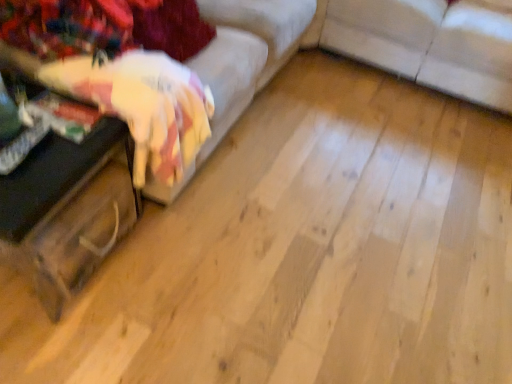
Question: Does velvet fabric couch at left, positioned as the first studio couch in left-to-right order, lie behind wooden trunk at left?

Choices:
 (A) no
 (B) yes

Answer: (A)

Question: Considering the relative positions of velvet fabric couch at left, which is counted as the second studio couch, starting from the right, and wooden trunk at left in the image provided, is velvet fabric couch at left, which is counted as the second studio couch, starting from the right, to the left of wooden trunk at left from the viewer's perspective?

Choices:
 (A) no
 (B) yes

Answer: (A)

Question: Considering the relative positions of velvet fabric couch at left, which is counted as the second studio couch, starting from the right, and wooden trunk at left in the image provided, is velvet fabric couch at left, which is counted as the second studio couch, starting from the right, to the right of wooden trunk at left from the viewer's perspective?

Choices:
 (A) yes
 (B) no

Answer: (A)

Question: Is velvet fabric couch at left, positioned as the first studio couch in left-to-right order, in contact with wooden trunk at left?

Choices:
 (A) yes
 (B) no

Answer: (B)

Question: Does velvet fabric couch at left, positioned as the first studio couch in left-to-right order, lie in front of wooden trunk at left?

Choices:
 (A) yes
 (B) no

Answer: (A)

Question: Visually, is velvet fabric couch at left, which is counted as the second studio couch, starting from the right, positioned to the left or to the right of wooden trunk at left?

Choices:
 (A) right
 (B) left

Answer: (A)

Question: From their relative heights in the image, would you say velvet fabric couch at left, positioned as the first studio couch in left-to-right order, is taller or shorter than wooden trunk at left?

Choices:
 (A) tall
 (B) short

Answer: (A)

Question: Would you say velvet fabric couch at left, positioned as the first studio couch in left-to-right order, is inside or outside wooden trunk at left?

Choices:
 (A) outside
 (B) inside

Answer: (A)

Question: Is point (160, 109) closer or farther from the camera than point (31, 266)?

Choices:
 (A) closer
 (B) farther

Answer: (A)

Question: Based on their positions, is white fabric couch at center, placed as the first studio couch when sorted from right to left, located to the left or right of wooden trunk at left?

Choices:
 (A) left
 (B) right

Answer: (B)

Question: Considering the positions of point (493, 69) and point (59, 180), is point (493, 69) closer or farther from the camera than point (59, 180)?

Choices:
 (A) closer
 (B) farther

Answer: (B)

Question: Is white fabric couch at center, positioned as the 2th studio couch in left-to-right order, in front of or behind wooden trunk at left in the image?

Choices:
 (A) front
 (B) behind

Answer: (B)

Question: In terms of height, does white fabric couch at center, placed as the first studio couch when sorted from right to left, look taller or shorter compared to wooden trunk at left?

Choices:
 (A) short
 (B) tall

Answer: (B)

Question: Is wooden trunk at left bigger or smaller than velvet fabric couch at left, which is counted as the second studio couch, starting from the right?

Choices:
 (A) big
 (B) small

Answer: (B)

Question: Choose the correct answer: Is wooden trunk at left inside velvet fabric couch at left, which is counted as the second studio couch, starting from the right, or outside it?

Choices:
 (A) outside
 (B) inside

Answer: (A)